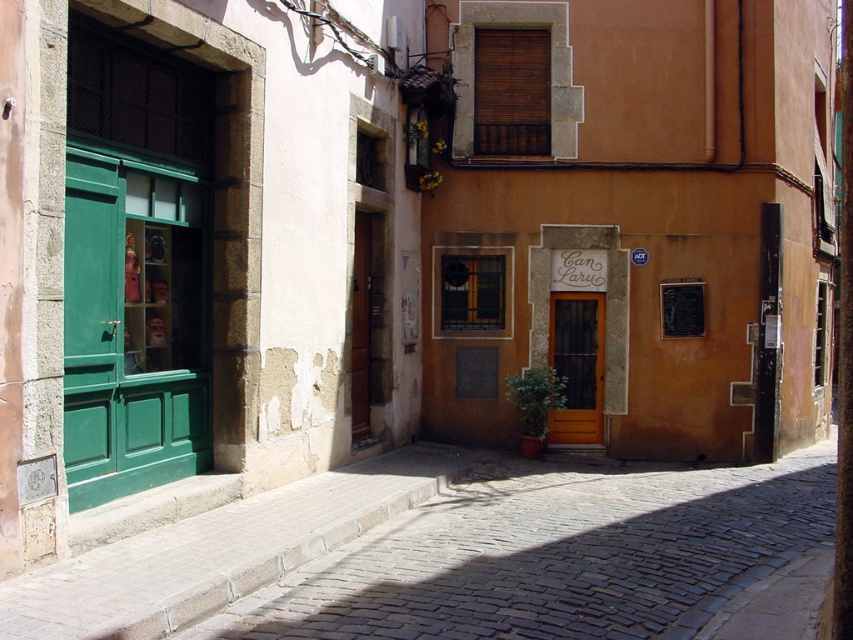
You are standing in the middle of the street looking towards the buildings. Which direction should you walk to reach the green wood door at left?

You should walk to the left to reach the green wood door at left since it is located on the left side of the street.

You are a delivery person carrying a heavy box and need to place it on the cobblestone pavement at lower center. However, there is a green wood door at left nearby. Which direction should you move to ensure the box is placed correctly?

The cobblestone pavement at lower center is located below the green wood door at left, so you should move downward from the green wood door at left to place the box on the cobblestone pavement at lower center.